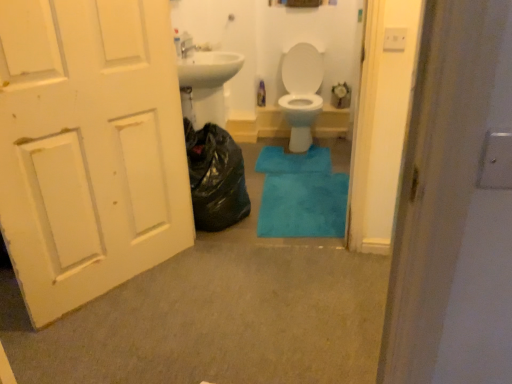
Question: Is blue plush bath mat at center, the 1th bath mat when ordered from bottom to top, with blue plush bath mat at center, the second bath mat positioned from the bottom?

Choices:
 (A) yes
 (B) no

Answer: (B)

Question: Is blue plush bath mat at center, which is the 2th bath mat in back-to-front order, wider than blue plush bath mat at center, positioned as the second bath mat in front-to-back order?

Choices:
 (A) no
 (B) yes

Answer: (B)

Question: Can you confirm if blue plush bath mat at center, which is counted as the 2th bath mat, starting from the top, is shorter than blue plush bath mat at center, which ranks as the first bath mat in top-to-bottom order?

Choices:
 (A) yes
 (B) no

Answer: (A)

Question: Is blue plush bath mat at center, which is counted as the 2th bath mat, starting from the top, outside of blue plush bath mat at center, the second bath mat positioned from the bottom?

Choices:
 (A) yes
 (B) no

Answer: (A)

Question: Is blue plush bath mat at center, the 1th bath mat when ordered from bottom to top, at the right side of blue plush bath mat at center, the 1th bath mat positioned from the back?

Choices:
 (A) no
 (B) yes

Answer: (B)

Question: Does blue plush bath mat at center, which is the 2th bath mat in back-to-front order, have a smaller size compared to blue plush bath mat at center, positioned as the second bath mat in front-to-back order?

Choices:
 (A) yes
 (B) no

Answer: (B)

Question: Is black plastic bag at left positioned behind white painted wood door at left?

Choices:
 (A) no
 (B) yes

Answer: (B)

Question: Considering the relative sizes of black plastic bag at left and white painted wood door at left in the image provided, is black plastic bag at left wider than white painted wood door at left?

Choices:
 (A) no
 (B) yes

Answer: (B)

Question: Is black plastic bag at left next to white painted wood door at left and touching it?

Choices:
 (A) yes
 (B) no

Answer: (B)

Question: Is black plastic bag at left facing away from white painted wood door at left?

Choices:
 (A) yes
 (B) no

Answer: (B)

Question: Could you tell me if black plastic bag at left is facing white painted wood door at left?

Choices:
 (A) yes
 (B) no

Answer: (B)

Question: Is white painted wood door at left completely or partially inside black plastic bag at left?

Choices:
 (A) yes
 (B) no

Answer: (B)

Question: Considering the relative positions of blue plush bath mat at center, which is the 2th bath mat in back-to-front order, and white painted wood door at left in the image provided, is blue plush bath mat at center, which is the 2th bath mat in back-to-front order, to the left of white painted wood door at left from the viewer's perspective?

Choices:
 (A) no
 (B) yes

Answer: (A)